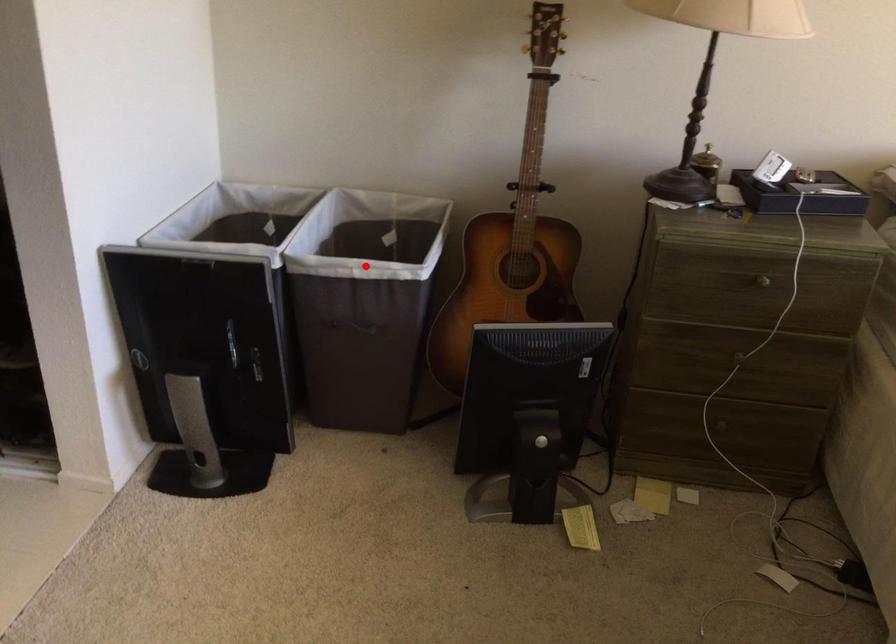
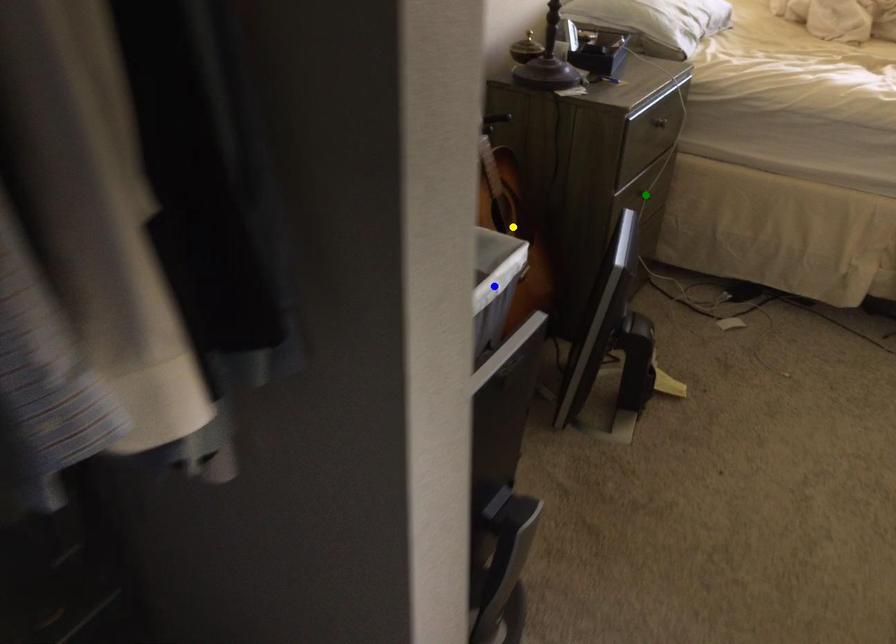
Question: I am providing you with two images of the same scene from different viewpoints. A red point is marked on the first image. You are given multiple points on the second image. Which spot in image 2 lines up with the point in image 1?

Choices:
 (A) yellow point
 (B) blue point
 (C) green point

Answer: (B)